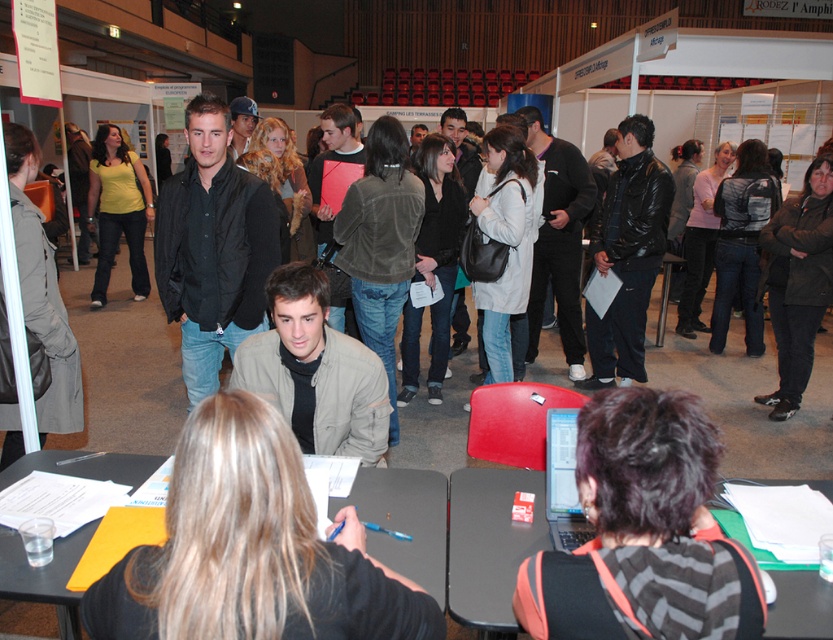
Question: Is the position of black plastic table at lower right less distant than that of black plastic table at center?

Choices:
 (A) yes
 (B) no

Answer: (A)

Question: Among these points, which one is farthest from the camera?

Choices:
 (A) (792, 618)
 (B) (113, 470)

Answer: (B)

Question: Observing the image, what is the correct spatial positioning of black plastic table at lower right in reference to black plastic table at center?

Choices:
 (A) right
 (B) left

Answer: (A)

Question: Which point appears farthest from the camera in this image?

Choices:
 (A) (505, 573)
 (B) (435, 564)

Answer: (B)

Question: Can you confirm if black plastic table at lower right is thinner than black plastic table at center?

Choices:
 (A) no
 (B) yes

Answer: (B)

Question: Which of the following is the closest to the observer?

Choices:
 (A) black plastic table at lower right
 (B) black plastic table at center

Answer: (A)